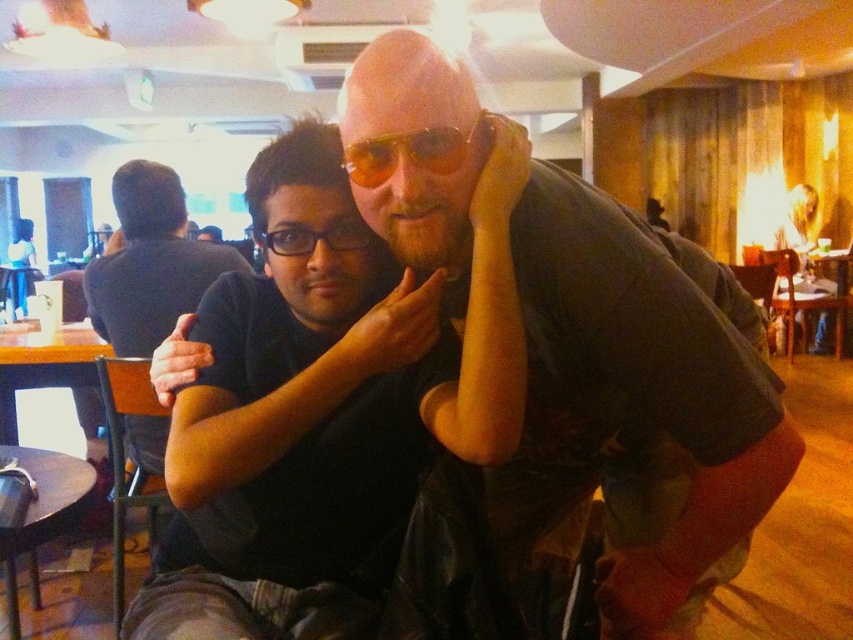
Between point (4, 444) and point (339, 358), which one is positioned behind?

The point (4, 444) is more distant.

The height and width of the screenshot is (640, 853). Find the location of `dark wood table at lower left`. dark wood table at lower left is located at coordinates (42, 515).

Measure the distance from matte skin hand at center to black plastic glasses at center.

They are 6.48 inches apart.

Does matte skin hand at center have a larger size compared to black plastic glasses at center?

Correct, matte skin hand at center is larger in size than black plastic glasses at center.

Is point (381, 323) less distant than point (343, 220)?

That is True.

What are the coordinates of `matte skin hand at center` in the screenshot? It's located at (392, 330).

Does matte black shirt at center appear on the right side of black plastic glasses at center?

Indeed, matte black shirt at center is positioned on the right side of black plastic glasses at center.

This screenshot has width=853, height=640. In order to click on matte black shirt at center in this screenshot , I will do pyautogui.click(x=631, y=413).

You are a GUI agent. You are given a task and a screenshot of the screen. Output one action in this format:
    pyautogui.click(x=<x>, y=<y>)
    Task: Click on the matte black shirt at center
    This screenshot has width=853, height=640.
    Given the screenshot: What is the action you would take?
    pyautogui.click(x=631, y=413)